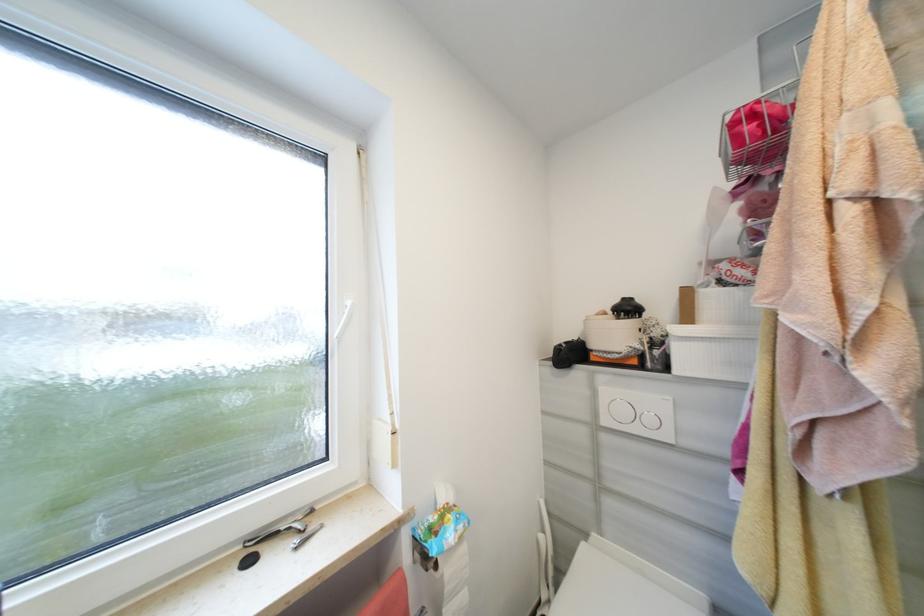
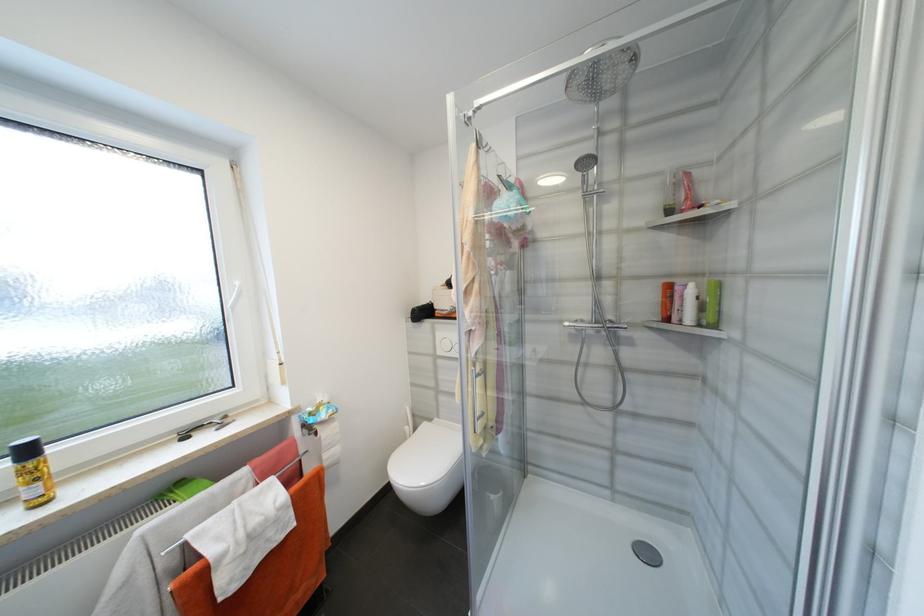
In the second image, find the point that corresponds to (x=354, y=304) in the first image.

(242, 285)